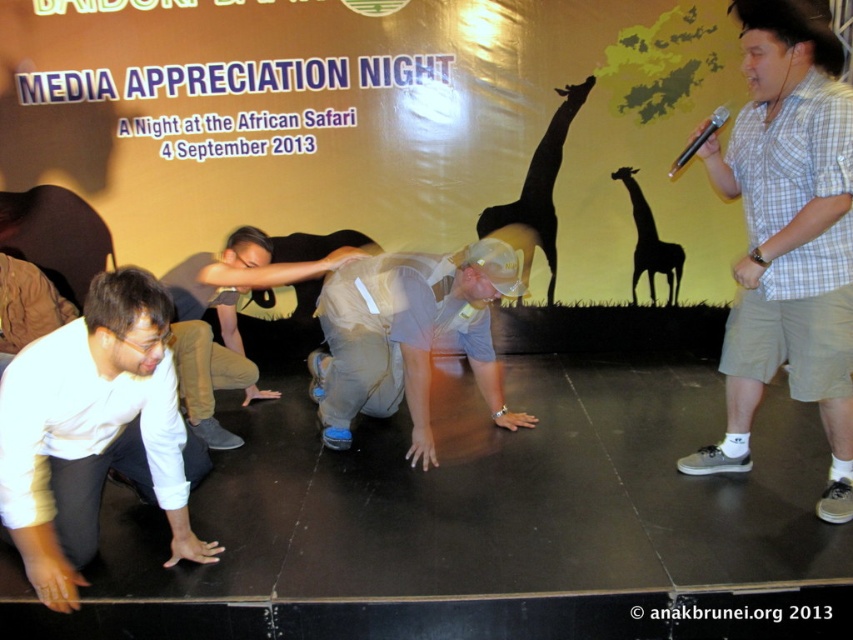
What is the relationship between the size of the gray fabric shirt at center and the white plastic bag at center?

The gray fabric shirt at center is larger in size than the white plastic bag at center.

You are standing at the point labeled point (740, 13). You want to take a photo of the backdrop which is 10 feet away from you. Can you take the photo without moving?

The distance between point (740, 13) and the camera is 7.44 feet, which is less than the 10 feet required to capture the backdrop. Therefore, you can take the photo without moving.